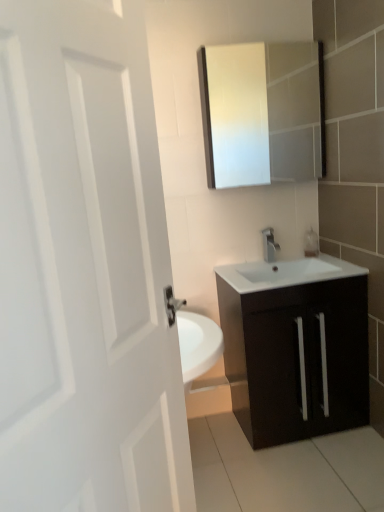
Locate an element on the screen. This screenshot has width=384, height=512. unoccupied region to the right of silver metallic tap at center is located at coordinates (299, 261).